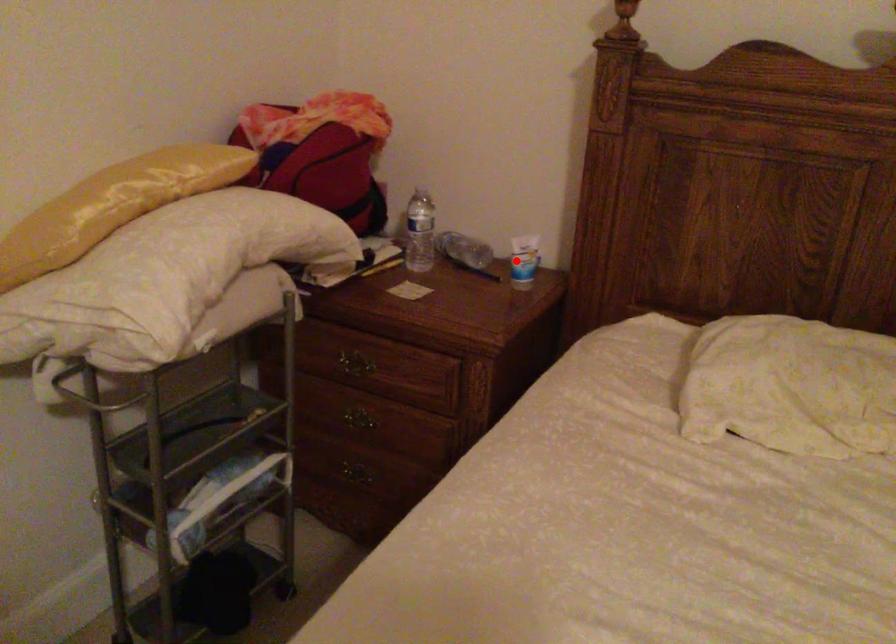
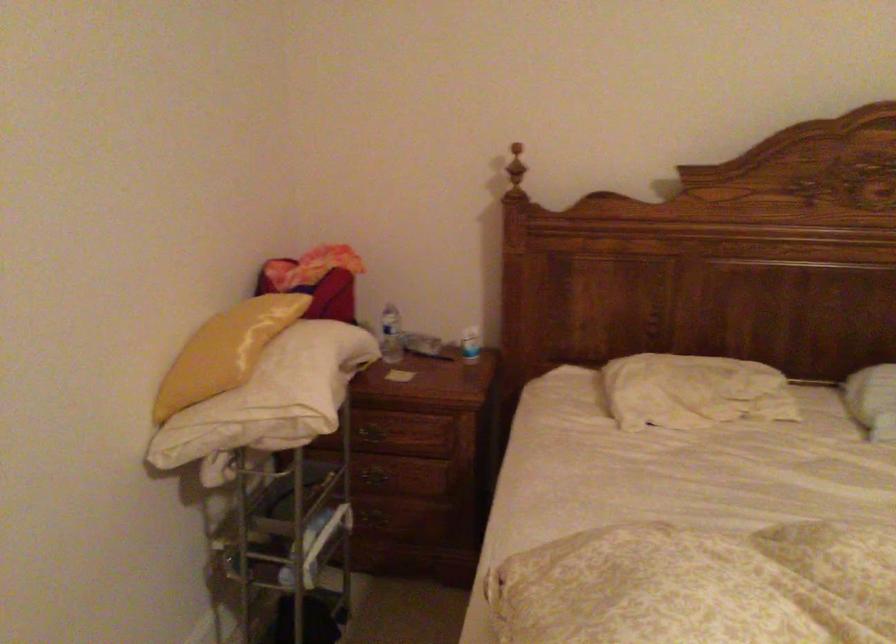
The point at the highlighted location is marked in the first image. Where is the corresponding point in the second image?

(470, 344)